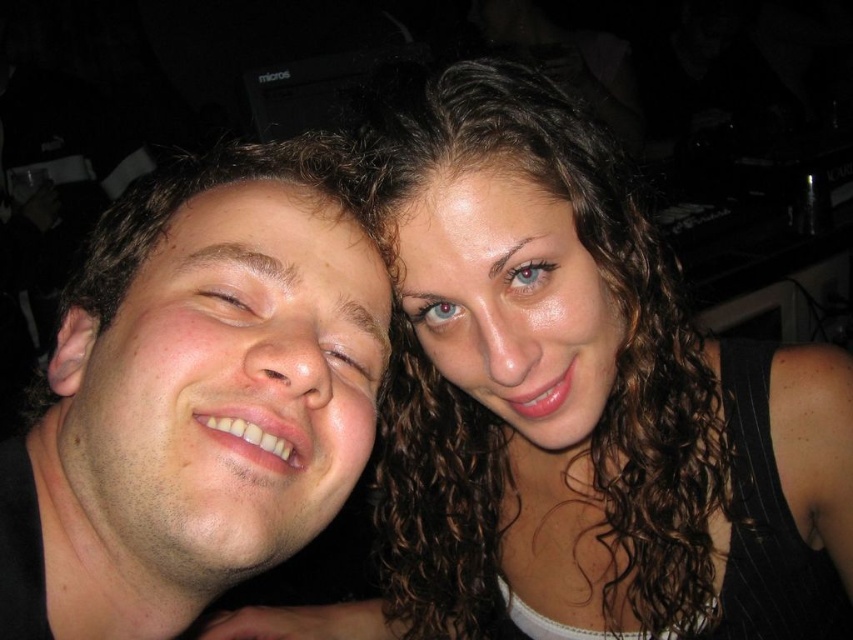
You are a photographer trying to adjust the lighting for a portrait. You notice two prominent hair styles in the image, the curly hair at center and the shiny brown hair at center. Which hairstyle should you focus your spotlight on to ensure it stands out more due to its size?

The curly hair at center is larger in size than the shiny brown hair at center, so you should focus the spotlight on the curly hair at center to make it stand out more due to its size.

You are a photographer adjusting the lighting for a portrait. The subjects have a matte skin face at center and shiny brown hair at center. Since the lighting needs to evenly illuminate both areas, which part might require a reflector to reduce glare and ensure proper exposure?

The shiny brown hair at center is below the matte skin face at center and may require a reflector to reduce glare since it is shinier and could cast shadows or overexpose under direct light.

You are a photographer trying to frame a portrait of two people with curly hair at center and shiny brown hair at center. Based on the scene, which person has hair that extends further to the sides?

The curly hair at center might be wider than shiny brown hair at center, so the person with curly hair at center has hair that extends further to the sides.